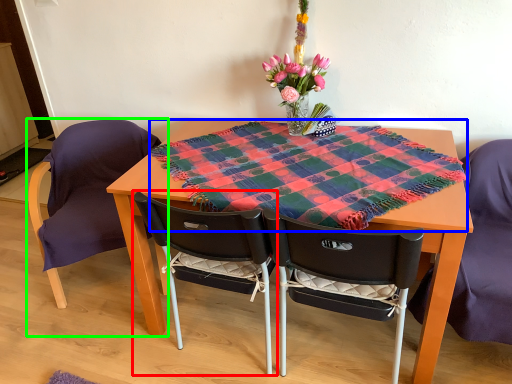
Question: Estimate the real-world distances between objects in this image. Which object is farther from chair (highlighted by a red box), blanket (highlighted by a blue box) or chair (highlighted by a green box)?

Choices:
 (A) blanket
 (B) chair

Answer: (B)